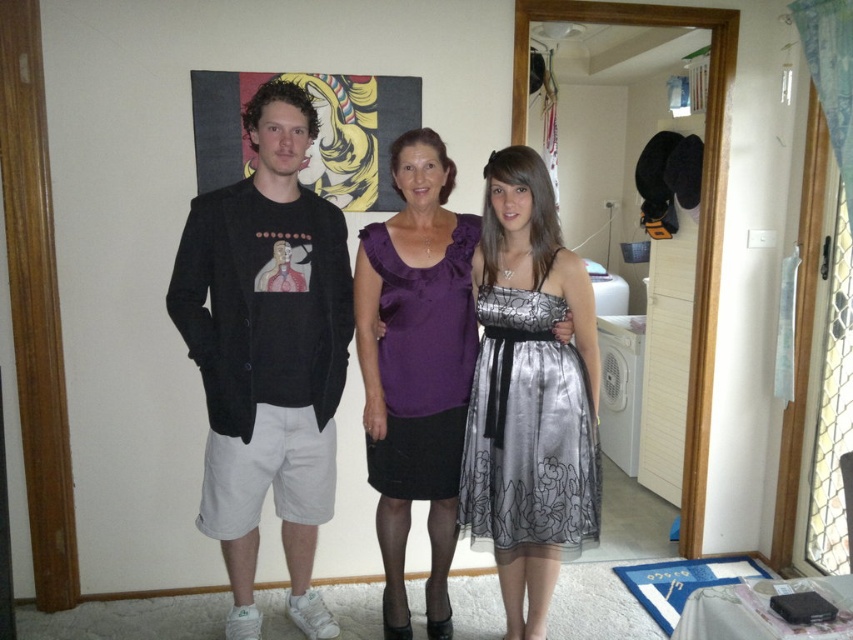
From the picture: Does silver satin dress at center have a larger size compared to silky purple blouse at center?

No, silver satin dress at center is not bigger than silky purple blouse at center.

The image size is (853, 640). In order to click on silver satin dress at center in this screenshot , I will do `click(529, 429)`.

Can you confirm if black cotton t-shirt at left is thinner than silky purple blouse at center?

Yes.

Between black cotton t-shirt at left and silky purple blouse at center, which one is positioned higher?

black cotton t-shirt at left

What do you see at coordinates (267, 353) in the screenshot? This screenshot has height=640, width=853. I see `black cotton t-shirt at left` at bounding box center [267, 353].

I want to click on black cotton t-shirt at left, so click(x=267, y=353).

Which is in front, point (404, 168) or point (364, 234)?

Point (404, 168) is in front.

Is silky purple blouse at center bigger than purple satin dress at center?

Yes, silky purple blouse at center is bigger than purple satin dress at center.

Is point (366, 392) more distant than point (421, 316)?

Yes, point (366, 392) is behind point (421, 316).

This screenshot has width=853, height=640. Find the location of `silky purple blouse at center`. silky purple blouse at center is located at coordinates (518, 218).